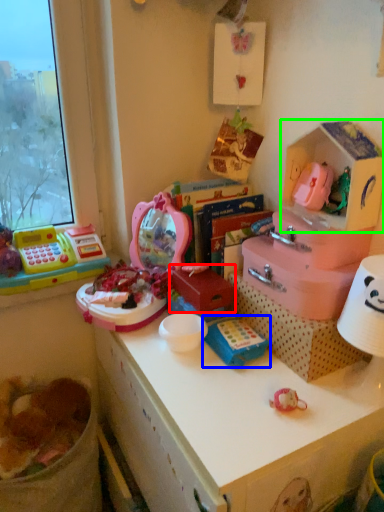
Question: Based on their relative distances, which object is nearer to box (highlighted by a red box)? Choose from toy (highlighted by a blue box) and storage box (highlighted by a green box).

Choices:
 (A) toy
 (B) storage box

Answer: (A)